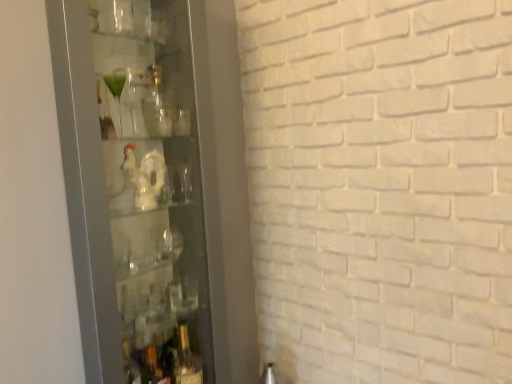
Question: In the image, is transparent glass cabinet at left positioned in front of or behind translucent glass bottle at lower center?

Choices:
 (A) front
 (B) behind

Answer: (A)

Question: From their relative heights in the image, would you say transparent glass cabinet at left is taller or shorter than translucent glass bottle at lower center?

Choices:
 (A) short
 (B) tall

Answer: (B)

Question: Based on their positions, is transparent glass cabinet at left located to the left or right of translucent glass bottle at lower center?

Choices:
 (A) right
 (B) left

Answer: (B)

Question: Is translucent glass bottle at lower center to the left or to the right of transparent glass cabinet at left in the image?

Choices:
 (A) left
 (B) right

Answer: (B)

Question: Would you say translucent glass bottle at lower center is inside or outside transparent glass cabinet at left?

Choices:
 (A) outside
 (B) inside

Answer: (B)

Question: Is point (181, 347) positioned closer to the camera than point (81, 215)?

Choices:
 (A) closer
 (B) farther

Answer: (B)

Question: Relative to transparent glass cabinet at left, is translucent glass bottle at lower center in front or behind?

Choices:
 (A) behind
 (B) front

Answer: (A)